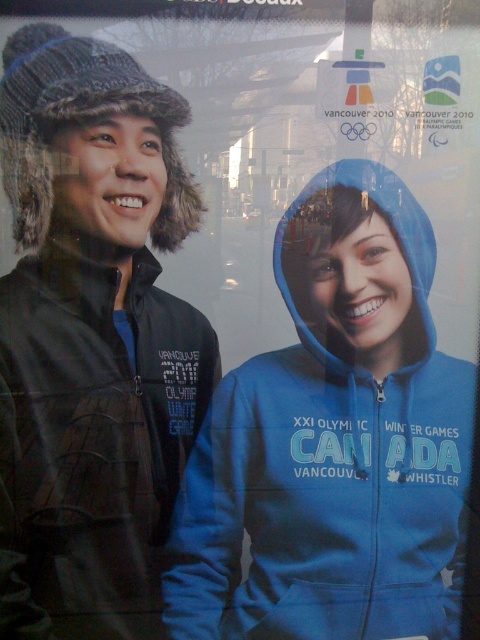
You are a photographer trying to focus on the person wearing the bright blue hoodie with Olympic Winter Games text. There is a point at coordinates point (92, 337) that you need to consider. Is this point located on the person wearing the dark winter jacket with fur lining or the bright blue hoodie?

The point (92, 337) is on the matte black jacket at left, so it is located on the person wearing the dark winter jacket with fur lining.